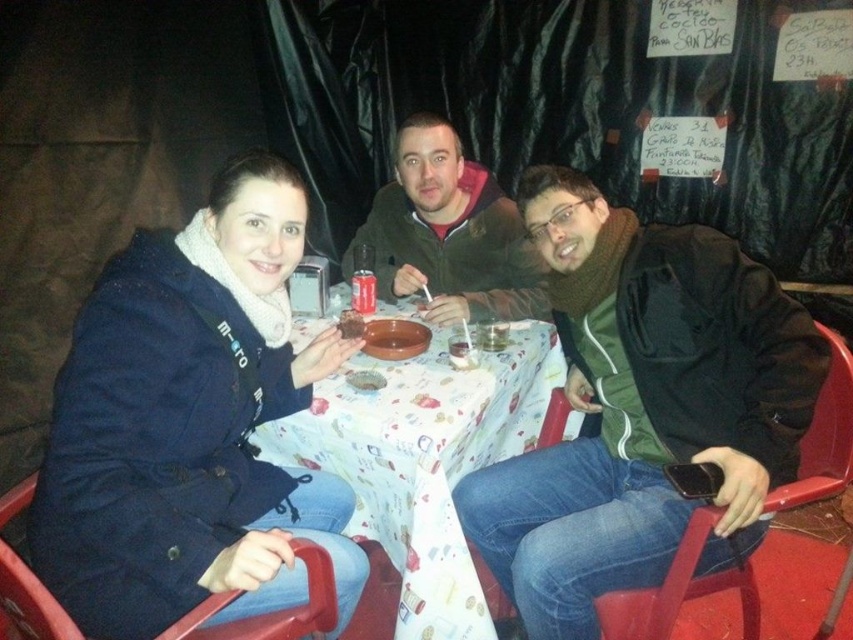
In the scene shown: Does navy blue coat at center have a smaller size compared to white paper tablecloth at center?

Yes, navy blue coat at center is smaller than white paper tablecloth at center.

What do you see at coordinates (190, 424) in the screenshot? I see `navy blue coat at center` at bounding box center [190, 424].

Which is in front, point (196, 432) or point (326, 426)?

Point (196, 432)

Where is `navy blue coat at center`? navy blue coat at center is located at coordinates (190, 424).

Can you confirm if navy blue coat at center is shorter than matte brown bowl at center?

Incorrect, navy blue coat at center's height does not fall short of matte brown bowl at center's.

Does point (247, 307) come closer to viewer compared to point (357, 337)?

Yes, point (247, 307) is in front of point (357, 337).

Locate an element on the screen. navy blue coat at center is located at coordinates (190, 424).

In order to click on navy blue coat at center in this screenshot , I will do `click(190, 424)`.

Which is more to the right, green matte jacket at center or matte brown jacket at center?

Positioned to the right is green matte jacket at center.

Looking at this image, can you confirm if green matte jacket at center is positioned to the left of matte brown jacket at center?

In fact, green matte jacket at center is to the right of matte brown jacket at center.

Locate an element on the screen. The width and height of the screenshot is (853, 640). green matte jacket at center is located at coordinates (642, 406).